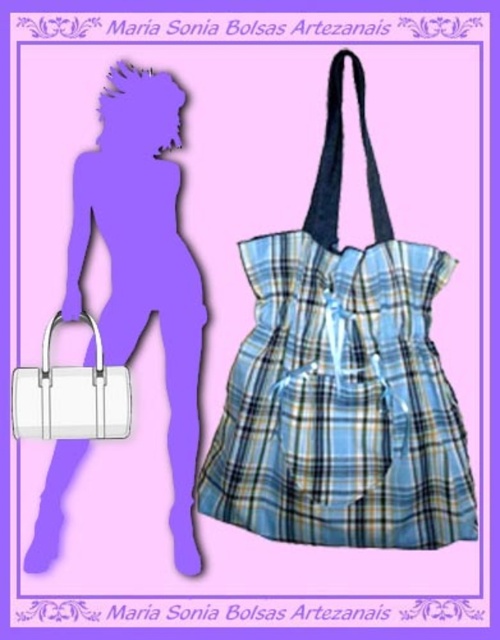
Please provide the coordinates of the blue plaid fabric dress at center in the image.

The blue plaid fabric dress at center is located at coordinates point [341,381].

You are designing a catalog layout for Maria Sonia Bolsas Artesanais. You need to place the blue plaid fabric dress at center and the white leather handbag at left in the catalog. The catalog page has limited space. Which object should you prioritize in terms of size to fit both items without overlapping?

The blue plaid fabric dress at center is larger in size compared to the white leather handbag at left, so you should prioritize scaling down the blue plaid fabric dress at center to ensure both items fit without overlapping.

What is the significance of the point at coordinates (341, 381) in the image?

The point at coordinates (341, 381) corresponds to the blue plaid fabric dress at center.